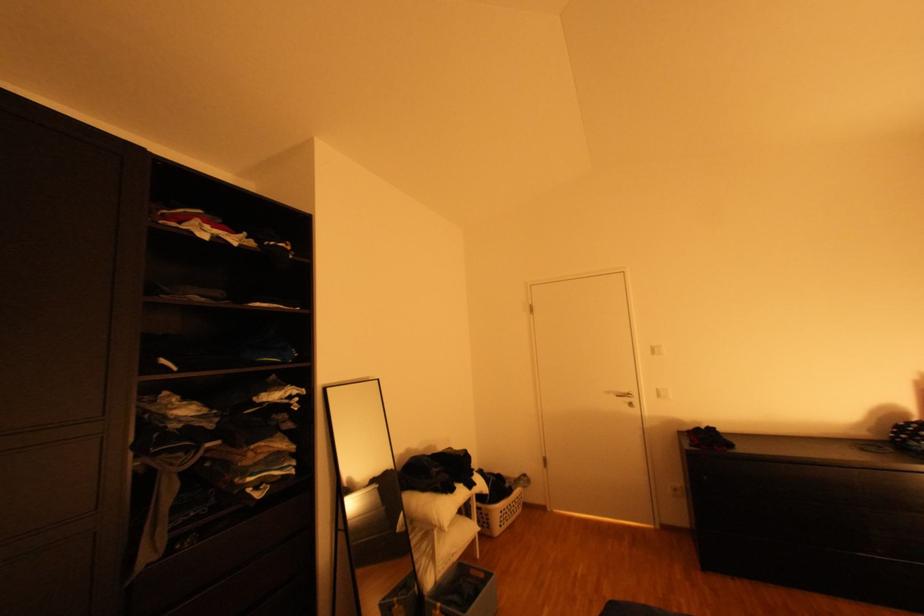
What do you see at coordinates (624, 397) in the screenshot? The width and height of the screenshot is (924, 616). I see `a silver door handle` at bounding box center [624, 397].